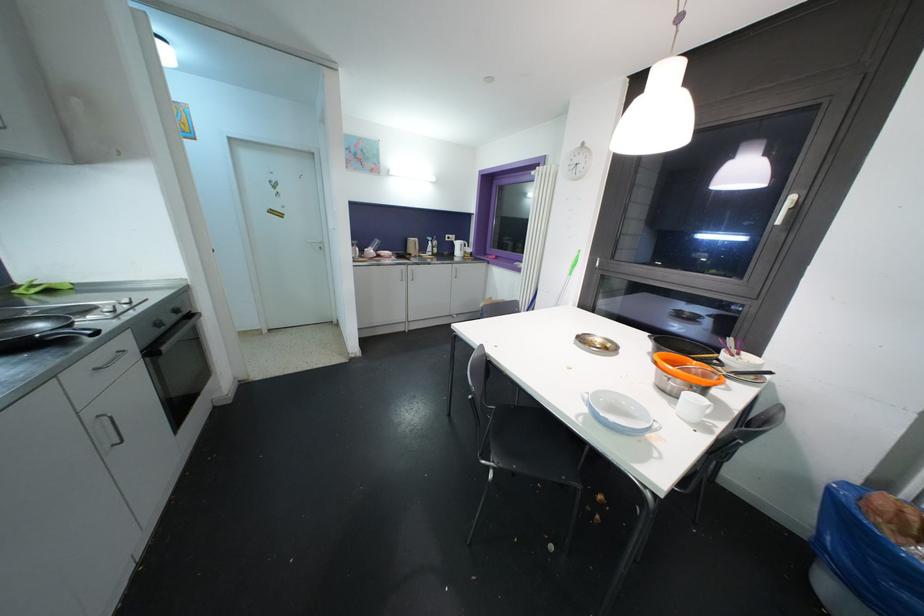
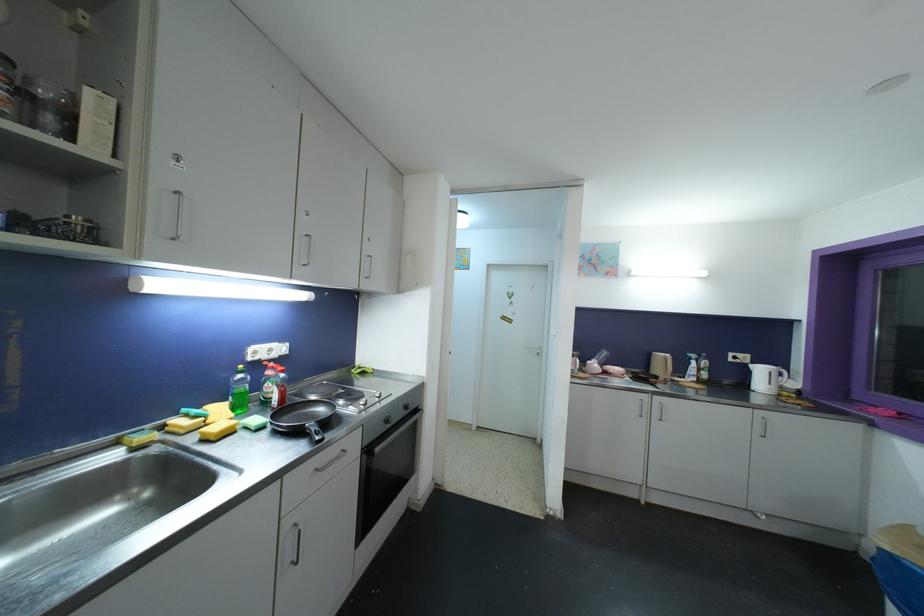
Where in the second image is the point corresponding to [493,302] from the first image?

(912, 532)